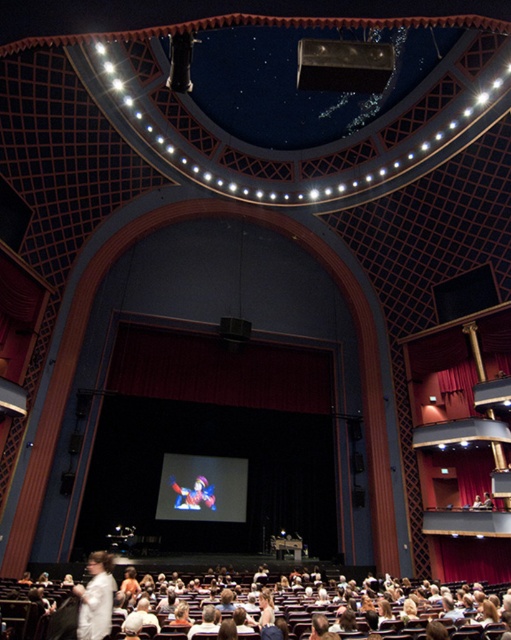
Does white fabric coat at lower center have a larger size compared to white matte shirt at lower left?

Yes, white fabric coat at lower center is bigger than white matte shirt at lower left.

Describe the element at coordinates (296, 605) in the screenshot. I see `white fabric coat at lower center` at that location.

Find the location of a particular element. The height and width of the screenshot is (640, 511). white fabric coat at lower center is located at coordinates (296, 605).

Does white matte shirt at lower left appear on the left side of multicolored plush toy at center?

Incorrect, white matte shirt at lower left is not on the left side of multicolored plush toy at center.

Is white matte shirt at lower left bigger than multicolored plush toy at center?

No.

Which is behind, point (94, 634) or point (172, 481)?

Point (172, 481)

Find the location of a particular element. This screenshot has width=511, height=640. white matte shirt at lower left is located at coordinates (96, 598).

Based on the photo, can you confirm if white fabric coat at lower center is shorter than multicolored plush toy at center?

In fact, white fabric coat at lower center may be taller than multicolored plush toy at center.

This screenshot has height=640, width=511. What are the coordinates of `white fabric coat at lower center` in the screenshot? It's located at pos(296,605).

The image size is (511, 640). I want to click on white fabric coat at lower center, so click(296, 605).